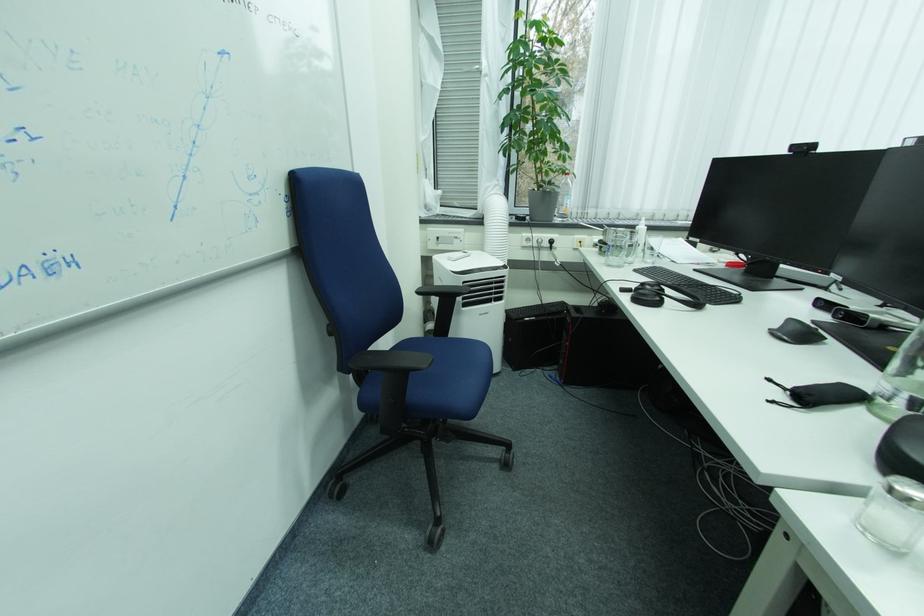
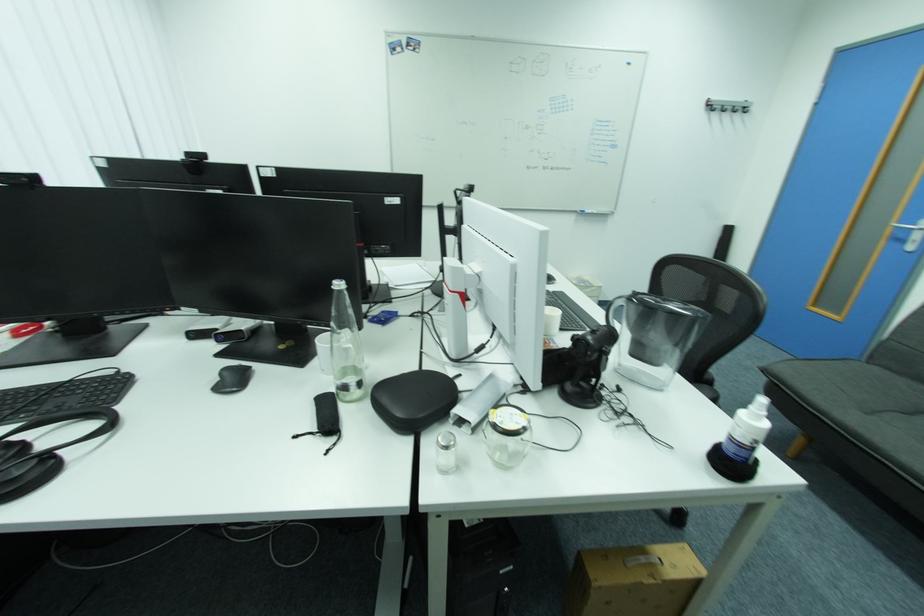
Find the pixel in the second image that matches (669,293) in the first image.

(29, 447)